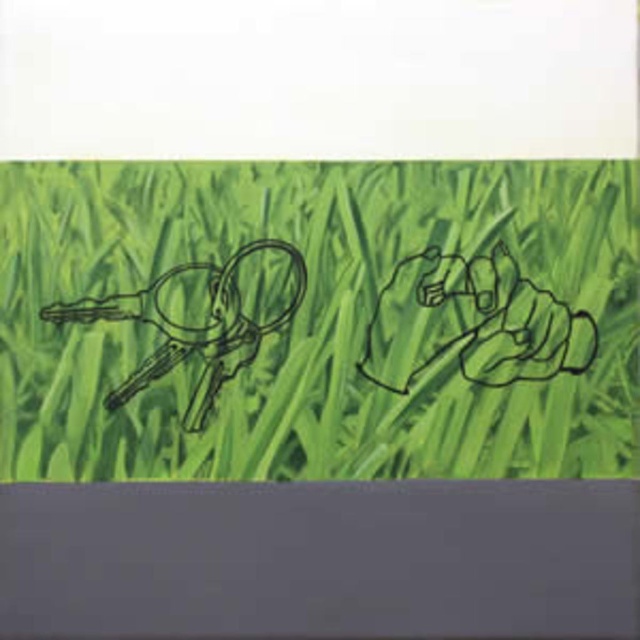
Question: Can you confirm if green grass at center is positioned below metallic keys at left?

Choices:
 (A) yes
 (B) no

Answer: (B)

Question: Which object is closer to the camera taking this photo?

Choices:
 (A) metallic keys at left
 (B) green grass at center

Answer: (B)

Question: Can you confirm if green grass at center is positioned below metallic keys at left?

Choices:
 (A) yes
 (B) no

Answer: (B)

Question: Which of the following is the closest to the observer?

Choices:
 (A) (266, 173)
 (B) (170, 275)

Answer: (B)

Question: Does green grass at center have a larger size compared to metallic keys at left?

Choices:
 (A) yes
 (B) no

Answer: (A)